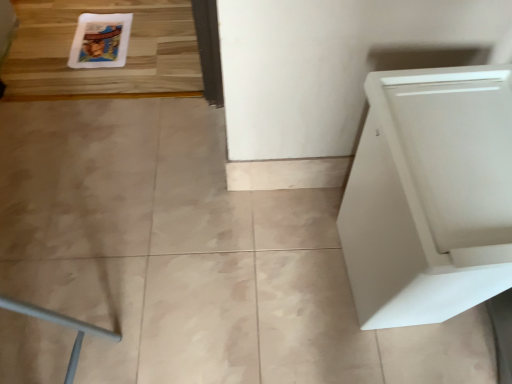
Question: Is white glossy comic book at upper left directly adjacent to white matte cabinet at right?

Choices:
 (A) yes
 (B) no

Answer: (B)

Question: Is white glossy comic book at upper left oriented towards white matte cabinet at right?

Choices:
 (A) no
 (B) yes

Answer: (A)

Question: Is white glossy comic book at upper left positioned beyond the bounds of white matte cabinet at right?

Choices:
 (A) yes
 (B) no

Answer: (A)

Question: From the image's perspective, is white glossy comic book at upper left below white matte cabinet at right?

Choices:
 (A) no
 (B) yes

Answer: (A)

Question: Considering the relative sizes of white glossy comic book at upper left and white matte cabinet at right in the image provided, is white glossy comic book at upper left shorter than white matte cabinet at right?

Choices:
 (A) no
 (B) yes

Answer: (B)

Question: Could white matte cabinet at right be considered to be inside white glossy comic book at upper left?

Choices:
 (A) no
 (B) yes

Answer: (A)

Question: Is white matte cabinet at right to the left of white glossy comic book at upper left from the viewer's perspective?

Choices:
 (A) yes
 (B) no

Answer: (B)

Question: Does white matte cabinet at right contain white glossy comic book at upper left?

Choices:
 (A) yes
 (B) no

Answer: (B)

Question: From the image's perspective, does white matte cabinet at right appear higher than white glossy comic book at upper left?

Choices:
 (A) no
 (B) yes

Answer: (A)

Question: Is white matte cabinet at right aimed at white glossy comic book at upper left?

Choices:
 (A) yes
 (B) no

Answer: (B)

Question: Does white matte cabinet at right have a smaller size compared to white glossy comic book at upper left?

Choices:
 (A) yes
 (B) no

Answer: (B)

Question: Considering the relative sizes of white matte cabinet at right and white glossy comic book at upper left in the image provided, is white matte cabinet at right bigger than white glossy comic book at upper left?

Choices:
 (A) yes
 (B) no

Answer: (A)

Question: Does point (104, 62) appear closer or farther from the camera than point (489, 97)?

Choices:
 (A) farther
 (B) closer

Answer: (A)